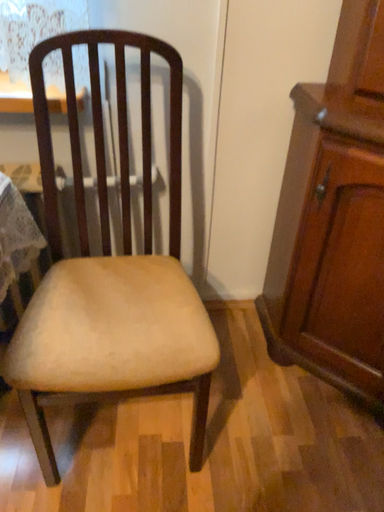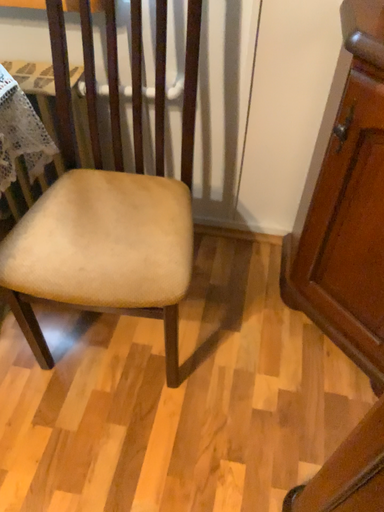
Question: How did the camera likely rotate when shooting the video?

Choices:
 (A) rotated left
 (B) rotated right

Answer: (A)